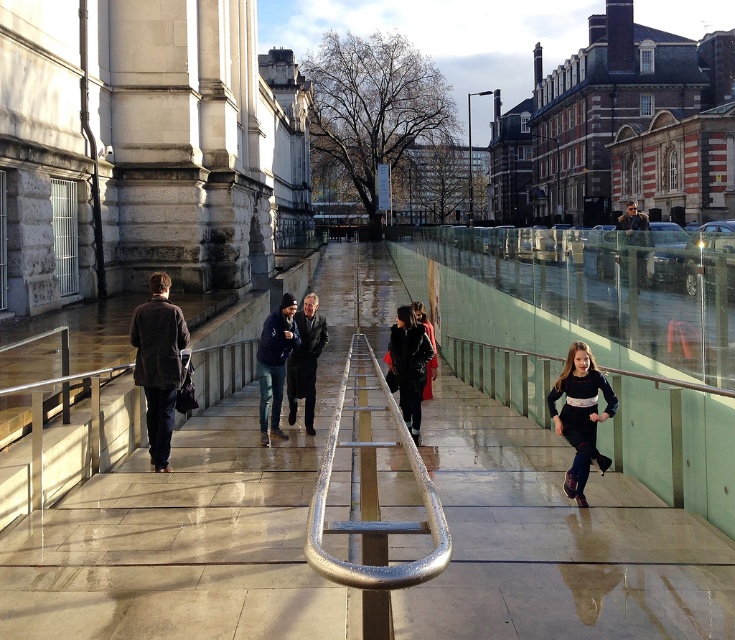
Is brown leather jacket at left to the right of dark brown leather jacket at center from the viewer's perspective?

Incorrect, brown leather jacket at left is not on the right side of dark brown leather jacket at center.

The image size is (735, 640). Describe the element at coordinates (157, 364) in the screenshot. I see `brown leather jacket at left` at that location.

You are a GUI agent. You are given a task and a screenshot of the screen. Output one action in this format:
    pyautogui.click(x=<x>, y=<y>)
    Task: Click on the brown leather jacket at left
    The height and width of the screenshot is (640, 735).
    Given the screenshot: What is the action you would take?
    pyautogui.click(x=157, y=364)

Which is below, dark blue jacket at center or dark brown leather coat at center?

dark brown leather coat at center

Between point (276, 323) and point (304, 408), which one is positioned in front?

Point (276, 323) is more forward.

Is point (265, 429) positioned in front of point (308, 371)?

Yes, point (265, 429) is closer to viewer.

Locate an element on the screen. The width and height of the screenshot is (735, 640). dark blue jacket at center is located at coordinates (273, 362).

Is silver metallic rail at center closer to camera compared to dark blue jacket at center?

Yes, silver metallic rail at center is closer to the viewer.

Is point (404, 570) closer to viewer compared to point (276, 380)?

Yes, it is.

You are a GUI agent. You are given a task and a screenshot of the screen. Output one action in this format:
    pyautogui.click(x=<x>, y=<y>)
    Task: Click on the silver metallic rail at center
    
    Given the screenshot: What is the action you would take?
    pyautogui.click(x=420, y=497)